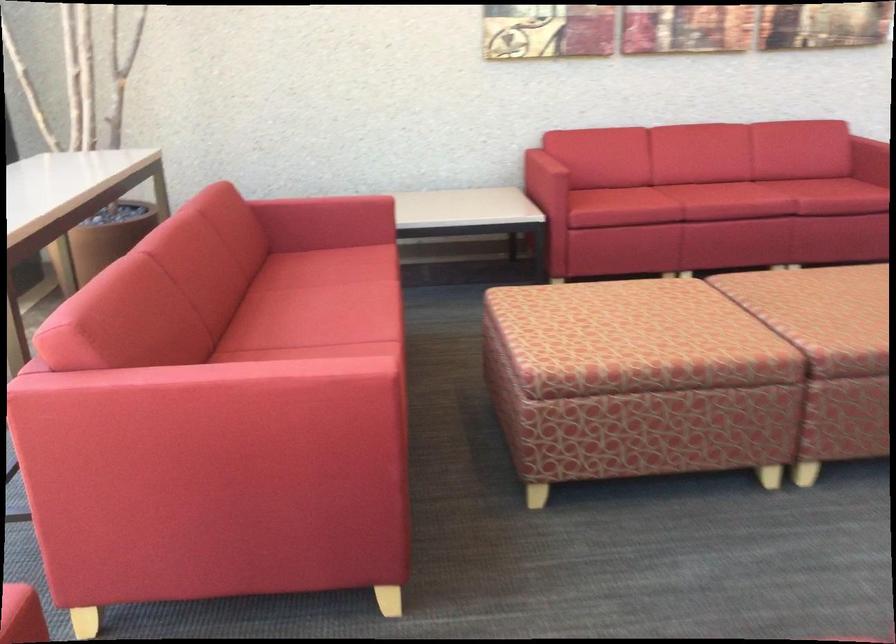
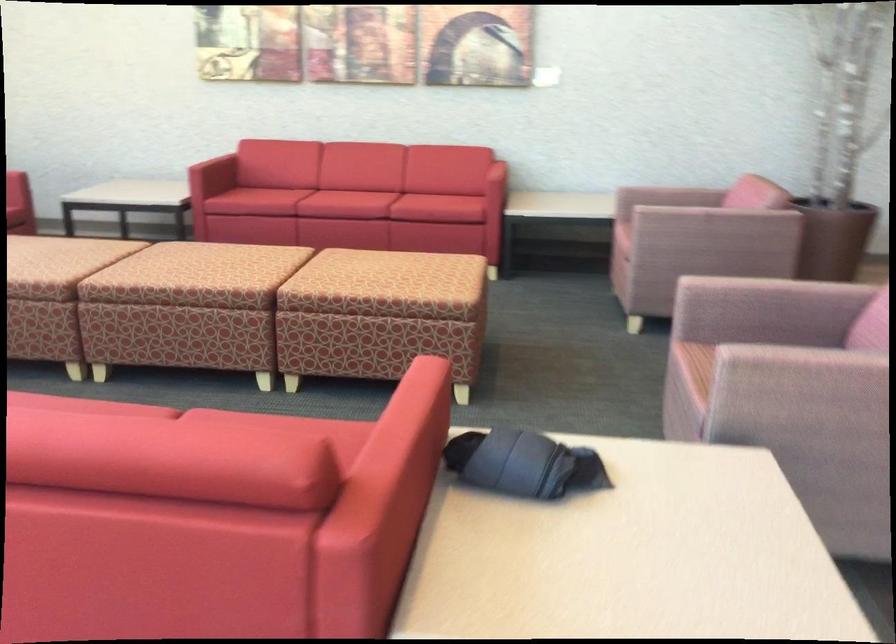
Question: Which direction would the cameraman need to move to produce the second image? Reply with the corresponding letter.

Choices:
 (A) Left
 (B) Right
 (C) Forward
 (D) Backward

Answer: (B)